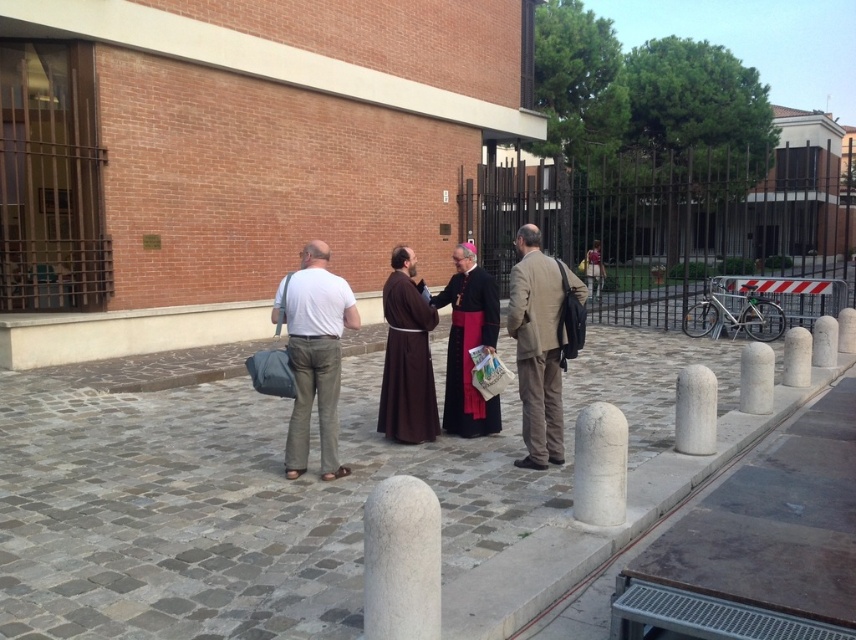
Question: Which point is farther to the camera?

Choices:
 (A) gray cobblestone pavement at center
 (B) brown matte robe at center
 (C) beige fabric coat at center
 (D) black velvet robe at center

Answer: (B)

Question: Which of the following is the farthest from the observer?

Choices:
 (A) (550, 330)
 (B) (581, 454)

Answer: (A)

Question: Which of these objects is positioned closest to the white stone pillar at lower right?

Choices:
 (A) brown matte robe at center
 (B) white textured pillar at lower center
 (C) white cotton shirt at center
 (D) beige fabric coat at center

Answer: (D)

Question: Does beige fabric coat at center come behind white stone pillar at lower right?

Choices:
 (A) no
 (B) yes

Answer: (B)

Question: Does gray cobblestone pavement at center appear on the left side of beige fabric coat at center?

Choices:
 (A) yes
 (B) no

Answer: (A)

Question: Is gray cobblestone pavement at center to the left of white cotton shirt at center from the viewer's perspective?

Choices:
 (A) no
 (B) yes

Answer: (A)